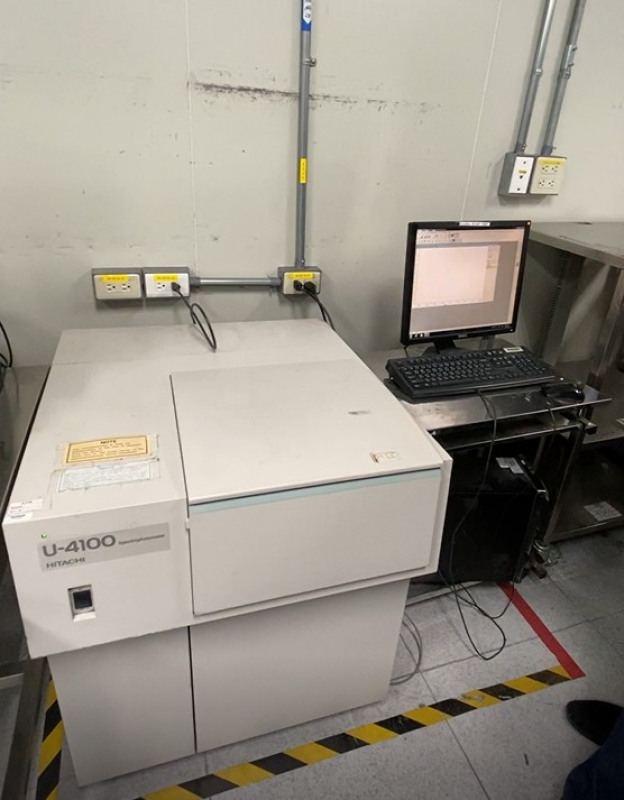
Find the location of a particular element. The width and height of the screenshot is (624, 800). shelves is located at coordinates (598, 250), (608, 422), (583, 521).